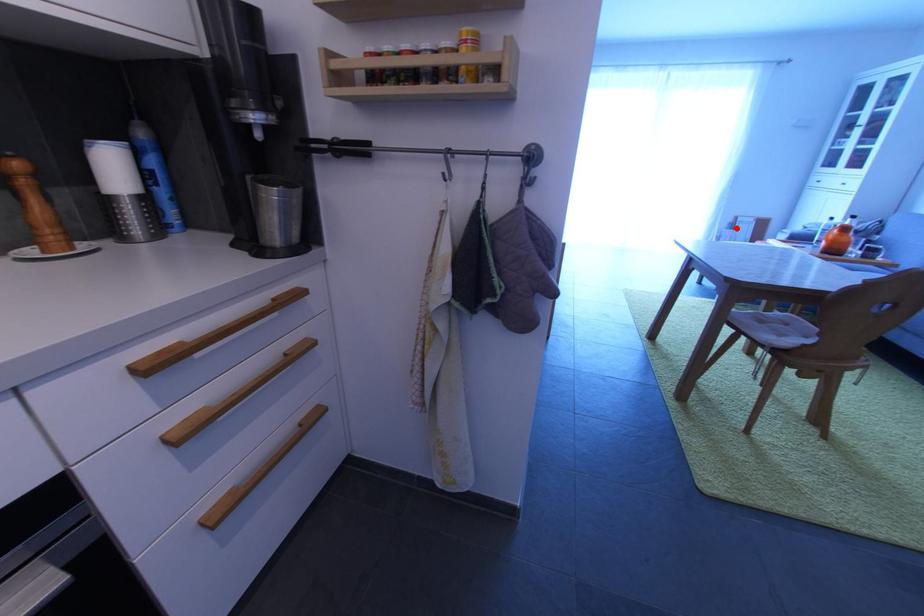
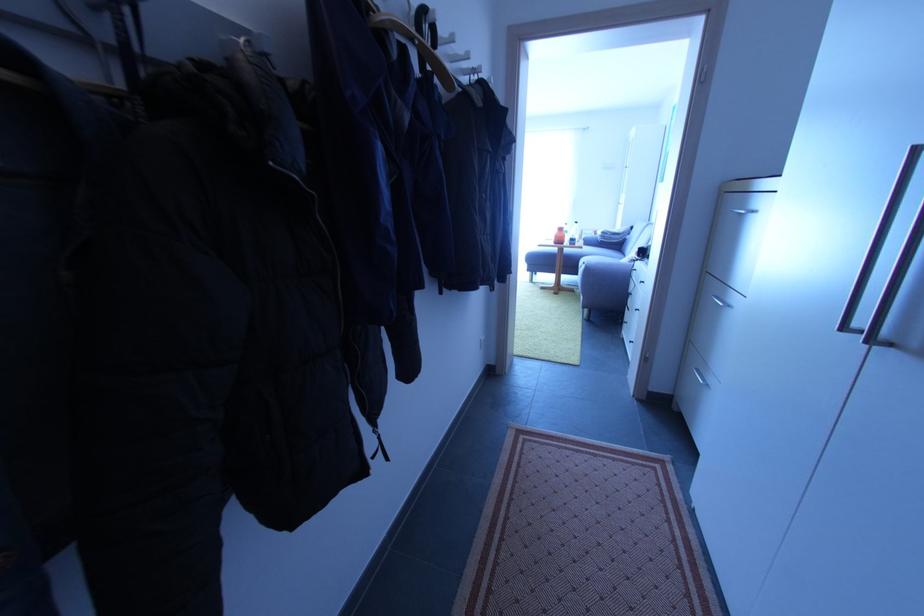
Question: I am providing you with two images of the same scene from different viewpoints. Image1 has a red point marked. In image2, the corresponding 3D location appears at what relative position? Reply with the corresponding letter.

Choices:
 (A) Closer
 (B) Farther

Answer: (B)